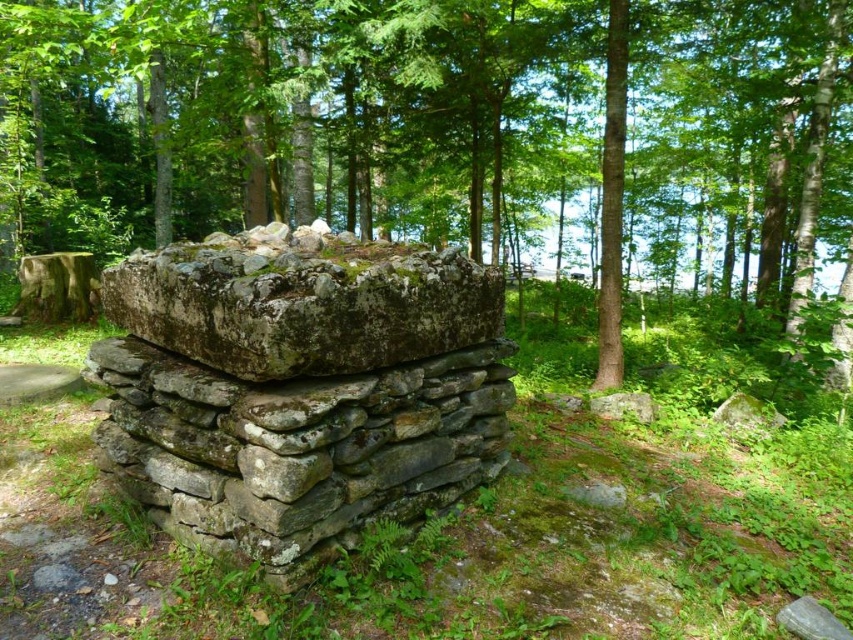
Which is above, green rough bark tree at center or gray stone wall at center?

green rough bark tree at center is above.

Find the location of a particular element. green rough bark tree at center is located at coordinates pyautogui.click(x=434, y=128).

Does gray stone wall at center have a smaller size compared to green mossy stone at center?

No.

Which is in front, point (143, 445) or point (256, 300)?

Point (256, 300) is in front.

Locate an element on the screen. The height and width of the screenshot is (640, 853). gray stone wall at center is located at coordinates (299, 388).

Is green rough bark tree at center behind green mossy stone at center?

Yes.

Is the position of green rough bark tree at center less distant than that of green mossy stone at center?

No, it is not.

Find the location of a particular element. green rough bark tree at center is located at coordinates (434, 128).